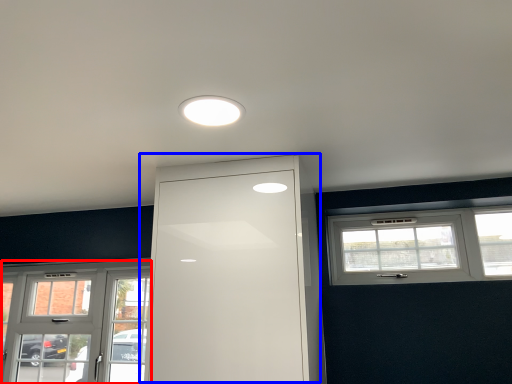
Question: Which of the following is the farthest to the observer, window (highlighted by a red box) or door (highlighted by a blue box)?

Choices:
 (A) window
 (B) door

Answer: (A)